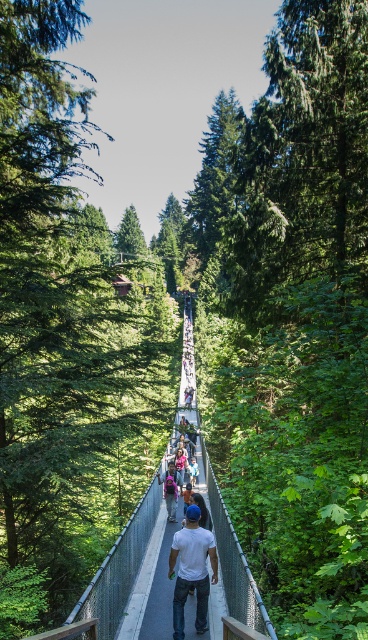
Question: Does white matte shirt at center appear over matte pink backpack at center?

Choices:
 (A) yes
 (B) no

Answer: (A)

Question: Among these points, which one is farthest from the camera?

Choices:
 (A) (190, 461)
 (B) (204, 554)

Answer: (A)

Question: Can you confirm if white matte shirt at center is wider than matte pink backpack at center?

Choices:
 (A) no
 (B) yes

Answer: (A)

Question: Which of the following is the closest to the observer?

Choices:
 (A) click(x=189, y=573)
 (B) click(x=195, y=465)

Answer: (A)

Question: Among these objects, which one is nearest to the camera?

Choices:
 (A) light blue denim jeans at center
 (B) matte pink backpack at center
 (C) metallic chain-link bridge at center
 (D) white matte shirt at center

Answer: (D)

Question: In this image, where is metallic chain-link bridge at center located relative to light blue denim jeans at center?

Choices:
 (A) left
 (B) right

Answer: (B)